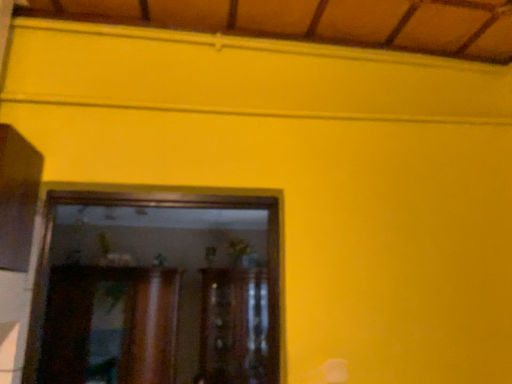
Question: Is wooden cabinet at center, arranged as the 2th cabinetry when viewed from the left, situated inside wooden cabinet at center, which appears as the 2th cabinetry when viewed from the right, or outside?

Choices:
 (A) outside
 (B) inside

Answer: (A)

Question: Considering their positions, is wooden cabinet at center, arranged as the 2th cabinetry when viewed from the left, located in front of or behind wooden cabinet at center, which is counted as the 1th cabinetry, starting from the left?

Choices:
 (A) front
 (B) behind

Answer: (B)

Question: From their relative heights in the image, would you say wooden cabinet at center, acting as the 1th cabinetry starting from the right, is taller or shorter than wooden cabinet at center, which appears as the 2th cabinetry when viewed from the right?

Choices:
 (A) short
 (B) tall

Answer: (B)

Question: Is point (68, 329) positioned closer to the camera than point (212, 289)?

Choices:
 (A) farther
 (B) closer

Answer: (B)

Question: Is wooden cabinet at center, which appears as the 2th cabinetry when viewed from the right, wider or thinner than wooden cabinet at center, acting as the 1th cabinetry starting from the right?

Choices:
 (A) thin
 (B) wide

Answer: (A)

Question: From a real-world perspective, is wooden cabinet at center, which is counted as the 1th cabinetry, starting from the left, positioned above or below wooden cabinet at center, arranged as the 2th cabinetry when viewed from the left?

Choices:
 (A) above
 (B) below

Answer: (A)

Question: Do you think wooden cabinet at center, which appears as the 2th cabinetry when viewed from the right, is within wooden cabinet at center, acting as the 1th cabinetry starting from the right, or outside of it?

Choices:
 (A) inside
 (B) outside

Answer: (B)